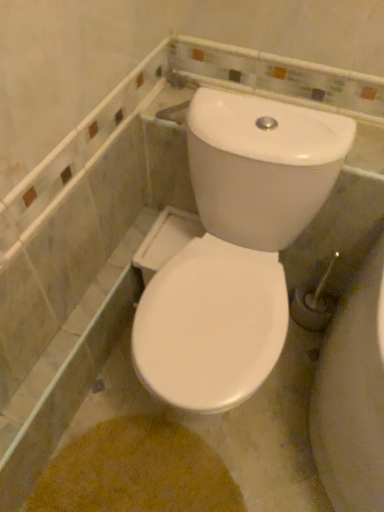
Question: Should I look upward or downward to see white glossy toilet at center?

Choices:
 (A) up
 (B) down

Answer: (B)